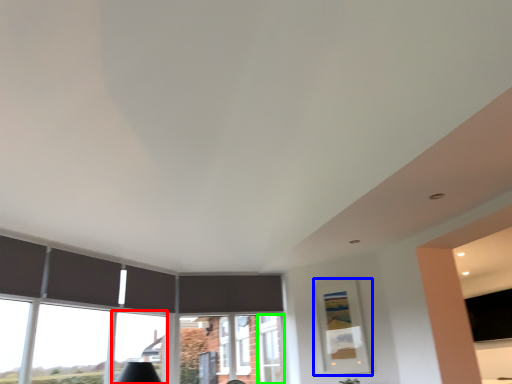
Question: Which object is positioned closest to window (highlighted by a red box)? Select from picture frame (highlighted by a blue box) and window frame (highlighted by a green box).

Choices:
 (A) picture frame
 (B) window frame

Answer: (B)